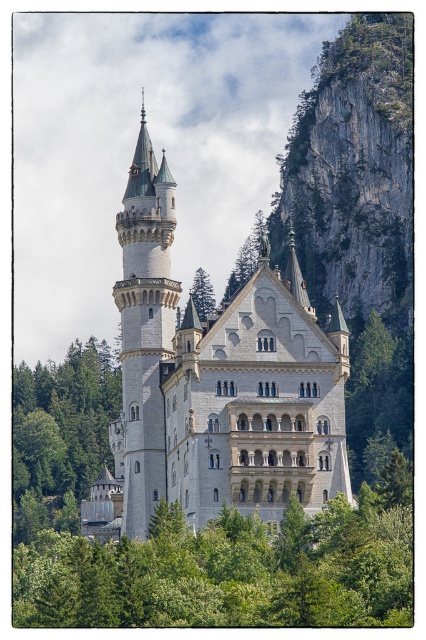
Question: Which point is closer to the camera?

Choices:
 (A) (285, 506)
 (B) (112, 400)
 (C) (126, 352)
 (D) (199, 298)

Answer: (A)

Question: Among these objects, which one is farthest from the camera?

Choices:
 (A) green leafy tree at center
 (B) green leafy tree at lower left
 (C) green matte tree at center
 (D) white stone tower at center-left

Answer: (C)

Question: Can you confirm if white stone tower at center-left is positioned to the left of green leafy tree at right?

Choices:
 (A) yes
 (B) no

Answer: (A)

Question: Which of the following is the farthest from the observer?

Choices:
 (A) white stone tower at center-left
 (B) white stone castle at center

Answer: (A)

Question: Can you confirm if green leafy tree at lower left is positioned above green matte tree at center?

Choices:
 (A) yes
 (B) no

Answer: (B)

Question: Does white stone castle at center appear on the left side of green matte tree at center?

Choices:
 (A) no
 (B) yes

Answer: (B)